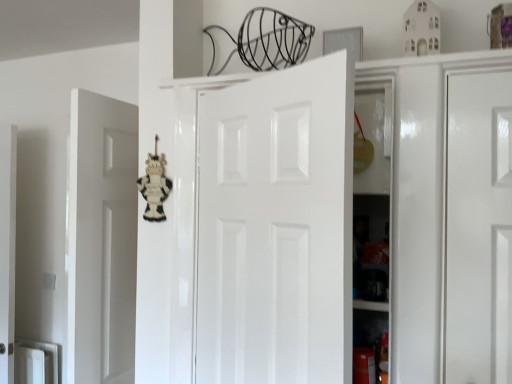
Question: From the image's perspective, is white glossy door at center below wooden cow at center?

Choices:
 (A) yes
 (B) no

Answer: (A)

Question: From a real-world perspective, is white glossy door at center on wooden cow at center?

Choices:
 (A) no
 (B) yes

Answer: (A)

Question: Would you say white glossy door at center is a long distance from wooden cow at center?

Choices:
 (A) no
 (B) yes

Answer: (A)

Question: Can you confirm if white glossy door at center is positioned to the right of wooden cow at center?

Choices:
 (A) no
 (B) yes

Answer: (B)

Question: Does white glossy door at center lie behind wooden cow at center?

Choices:
 (A) yes
 (B) no

Answer: (B)

Question: Can you confirm if white glossy door at center is shorter than wooden cow at center?

Choices:
 (A) no
 (B) yes

Answer: (A)

Question: Does wooden cow at center turn towards white glossy door at center?

Choices:
 (A) no
 (B) yes

Answer: (A)

Question: Is wooden cow at center further to camera compared to white glossy door at center?

Choices:
 (A) yes
 (B) no

Answer: (A)

Question: Is wooden cow at center completely or partially outside of white glossy door at center?

Choices:
 (A) yes
 (B) no

Answer: (A)

Question: From the image's perspective, is wooden cow at center on top of white glossy door at center?

Choices:
 (A) no
 (B) yes

Answer: (B)

Question: Can you confirm if wooden cow at center is positioned to the left of white glossy door at center?

Choices:
 (A) yes
 (B) no

Answer: (A)

Question: Considering the relative sizes of wooden cow at center and white glossy door at center in the image provided, is wooden cow at center smaller than white glossy door at center?

Choices:
 (A) yes
 (B) no

Answer: (A)

Question: Does point tap(146, 168) appear closer or farther from the camera than point tap(284, 274)?

Choices:
 (A) farther
 (B) closer

Answer: (A)